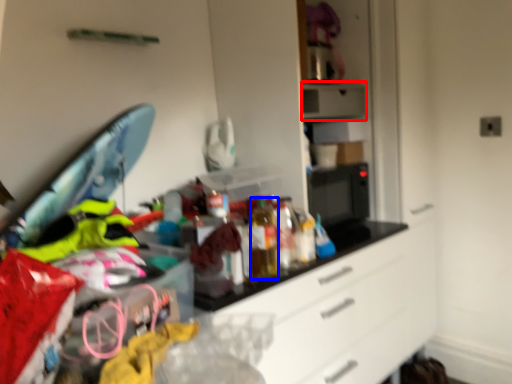
Question: Among these objects, which one is nearest to the camera, appliance (highlighted by a red box) or bottle (highlighted by a blue box)?

Choices:
 (A) appliance
 (B) bottle

Answer: (B)